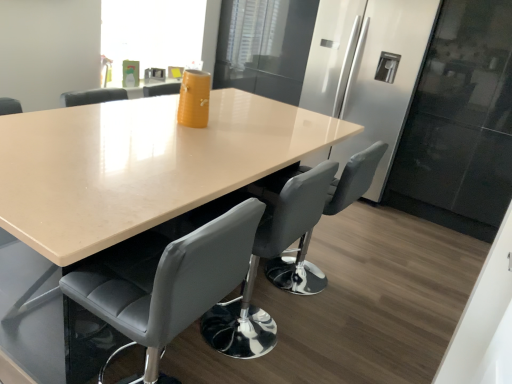
The width and height of the screenshot is (512, 384). Describe the element at coordinates (140, 165) in the screenshot. I see `beige glossy table at center` at that location.

Measure the distance between transparent glass window screen at upper center and camera.

They are 3.33 meters apart.

The width and height of the screenshot is (512, 384). What do you see at coordinates (166, 280) in the screenshot?
I see `gray leather chair at center, the 1th chair viewed from the front` at bounding box center [166, 280].

What is the approximate width of gray leather chair at center, the first chair in the back-to-front sequence?

It is 45.22 centimeters.

The image size is (512, 384). Find the location of `beige glossy table at center`. beige glossy table at center is located at coordinates (140, 165).

The height and width of the screenshot is (384, 512). I want to click on table that appears in front of the sleek stainless steel fridge at center, so point(140,165).

From the image's perspective, is sleek stainless steel fridge at center under beige glossy table at center?

No, from the image's perspective, sleek stainless steel fridge at center is not below beige glossy table at center.

Based on the photo, from a real-world perspective, which object stands above the other?

sleek stainless steel fridge at center.

Which of these two, sleek stainless steel fridge at center or beige glossy table at center, is bigger?

With larger size is beige glossy table at center.

Is gray leather chair at center, placed as the 2th chair when sorted from front to back, oriented towards gray leather chair at center, the second chair viewed from the back?

No, gray leather chair at center, placed as the 2th chair when sorted from front to back, is not aimed at gray leather chair at center, the second chair viewed from the back.

Is gray leather chair at center, placed as the 2th chair when sorted from front to back, touching gray leather chair at center, the 1th chair viewed from the front?

No, gray leather chair at center, placed as the 2th chair when sorted from front to back, is not touching gray leather chair at center, the 1th chair viewed from the front.

The height and width of the screenshot is (384, 512). What are the coordinates of `chair behind the gray leather chair at center, the second chair viewed from the back` in the screenshot? It's located at (267, 258).

How many degrees apart are the facing directions of transparent glass window screen at upper center and beige glossy table at center?

0.802 degrees separate the facing orientations of transparent glass window screen at upper center and beige glossy table at center.

Considering the relative sizes of transparent glass window screen at upper center and beige glossy table at center in the image provided, is transparent glass window screen at upper center taller than beige glossy table at center?

In fact, transparent glass window screen at upper center may be shorter than beige glossy table at center.

From a real-world perspective, is transparent glass window screen at upper center beneath beige glossy table at center?

No, from a real-world perspective, transparent glass window screen at upper center is not below beige glossy table at center.

Is point (148, 277) more distant than point (282, 219)?

No, (148, 277) is closer to viewer.

In terms of size, does gray leather chair at center, the second chair viewed from the back, appear bigger or smaller than gray leather chair at center, placed as the 2th chair when sorted from front to back?

In the image, gray leather chair at center, the second chair viewed from the back, appears to be larger than gray leather chair at center, placed as the 2th chair when sorted from front to back.

Looking at this image, from the image's perspective, between gray leather chair at center, the second chair viewed from the back, and gray leather chair at center, placed as the 2th chair when sorted from front to back, which one is located above?

gray leather chair at center, placed as the 2th chair when sorted from front to back, is shown above in the image.

Which object is more forward, gray leather chair at center, the second chair viewed from the back, or gray leather chair at center, the first chair in the back-to-front sequence?

gray leather chair at center, the second chair viewed from the back, is more forward.

Is point (389, 125) positioned after point (325, 195)?

Yes, it is.

Is sleek stainless steel fridge at center wider than gray leather chair at center, placed as the 2th chair when sorted from front to back?

Correct, the width of sleek stainless steel fridge at center exceeds that of gray leather chair at center, placed as the 2th chair when sorted from front to back.

From a real-world perspective, starting from the sleek stainless steel fridge at center, which chair is the 2nd one below it? Please provide its 2D coordinates.

[(267, 258)]

Is sleek stainless steel fridge at center at the left side of gray leather chair at center, the first chair in the back-to-front sequence?

No, sleek stainless steel fridge at center is not to the left of gray leather chair at center, the first chair in the back-to-front sequence.

Can you confirm if gray leather chair at center, the first chair in the back-to-front sequence, is taller than sleek stainless steel fridge at center?

No, gray leather chair at center, the first chair in the back-to-front sequence, is not taller than sleek stainless steel fridge at center.

Choose the correct answer: Is gray leather chair at center, placed as the 2th chair when sorted from front to back, inside sleek stainless steel fridge at center or outside it?

gray leather chair at center, placed as the 2th chair when sorted from front to back, is not enclosed by sleek stainless steel fridge at center.

Does gray leather chair at center, the first chair in the back-to-front sequence, appear on the right side of sleek stainless steel fridge at center?

Incorrect, gray leather chair at center, the first chair in the back-to-front sequence, is not on the right side of sleek stainless steel fridge at center.

From the image's perspective, would you say transparent glass window screen at upper center is positioned over gray leather chair at center, the first chair in the back-to-front sequence?

Yes.

Does transparent glass window screen at upper center have a larger size compared to gray leather chair at center, placed as the 2th chair when sorted from front to back?

Yes, transparent glass window screen at upper center is bigger than gray leather chair at center, placed as the 2th chair when sorted from front to back.

Is gray leather chair at center, placed as the 2th chair when sorted from front to back, at the back of transparent glass window screen at upper center?

No, transparent glass window screen at upper center's orientation is not away from gray leather chair at center, placed as the 2th chair when sorted from front to back.

From a real-world perspective, does transparent glass window screen at upper center stand above gray leather chair at center, placed as the 2th chair when sorted from front to back?

Yes, from a real-world perspective, transparent glass window screen at upper center is on top of gray leather chair at center, placed as the 2th chair when sorted from front to back.

Locate an element on the screen. The height and width of the screenshot is (384, 512). table on the left of sleek stainless steel fridge at center is located at coordinates (140, 165).

Where is `chair below the gray leather chair at center, the first chair in the back-to-front sequence (from the image's perspective)`? The width and height of the screenshot is (512, 384). chair below the gray leather chair at center, the first chair in the back-to-front sequence (from the image's perspective) is located at coordinates (166, 280).

In the scene shown: Estimate the real-world distances between objects in this image. Which object is further from transparent glass window screen at upper center, beige glossy table at center or gray leather chair at center, the second chair viewed from the back?

gray leather chair at center, the second chair viewed from the back.

When comparing their distances from gray leather chair at center, the 1th chair viewed from the front, does sleek stainless steel fridge at center or gray leather chair at center, the first chair in the back-to-front sequence, seem further?

sleek stainless steel fridge at center is positioned further to the anchor gray leather chair at center, the 1th chair viewed from the front.

Considering their positions, is gray leather chair at center, the first chair in the back-to-front sequence, positioned further to gray leather chair at center, the second chair viewed from the back, than transparent glass window screen at upper center?

The object further to gray leather chair at center, the second chair viewed from the back, is transparent glass window screen at upper center.

When comparing their distances from transparent glass window screen at upper center, does gray leather chair at center, the second chair viewed from the back, or gray leather chair at center, the first chair in the back-to-front sequence, seem further?

Among the two, gray leather chair at center, the second chair viewed from the back, is located further to transparent glass window screen at upper center.

Estimate the real-world distances between objects in this image. Which object is further from gray leather chair at center, the second chair viewed from the back, sleek stainless steel fridge at center or transparent glass window screen at upper center?

transparent glass window screen at upper center lies further to gray leather chair at center, the second chair viewed from the back, than the other object.

Considering their positions, is beige glossy table at center positioned closer to transparent glass window screen at upper center than sleek stainless steel fridge at center?

Among the two, sleek stainless steel fridge at center is located nearer to transparent glass window screen at upper center.

Estimate the real-world distances between objects in this image. Which object is further from beige glossy table at center, gray leather chair at center, placed as the 2th chair when sorted from front to back, or gray leather chair at center, the 1th chair viewed from the front?

gray leather chair at center, placed as the 2th chair when sorted from front to back.

Estimate the real-world distances between objects in this image. Which object is closer to sleek stainless steel fridge at center, gray leather chair at center, the first chair in the back-to-front sequence, or transparent glass window screen at upper center?

transparent glass window screen at upper center.

In order to click on chair positioned between beige glossy table at center and gray leather chair at center, placed as the 2th chair when sorted from front to back, from near to far in this screenshot , I will do `click(166, 280)`.

At what (x,y) coordinates should I click in order to perform the action: click on chair between gray leather chair at center, the 1th chair viewed from the front, and sleek stainless steel fridge at center in the front-back direction. Please return your answer as a coordinate pair (x, y). Looking at the image, I should click on (267, 258).

In order to click on fridge positioned between gray leather chair at center, the second chair viewed from the back, and transparent glass window screen at upper center from near to far in this screenshot , I will do `click(367, 73)`.

I want to click on chair located between gray leather chair at center, the 1th chair viewed from the front, and transparent glass window screen at upper center in the depth direction, so click(x=267, y=258).